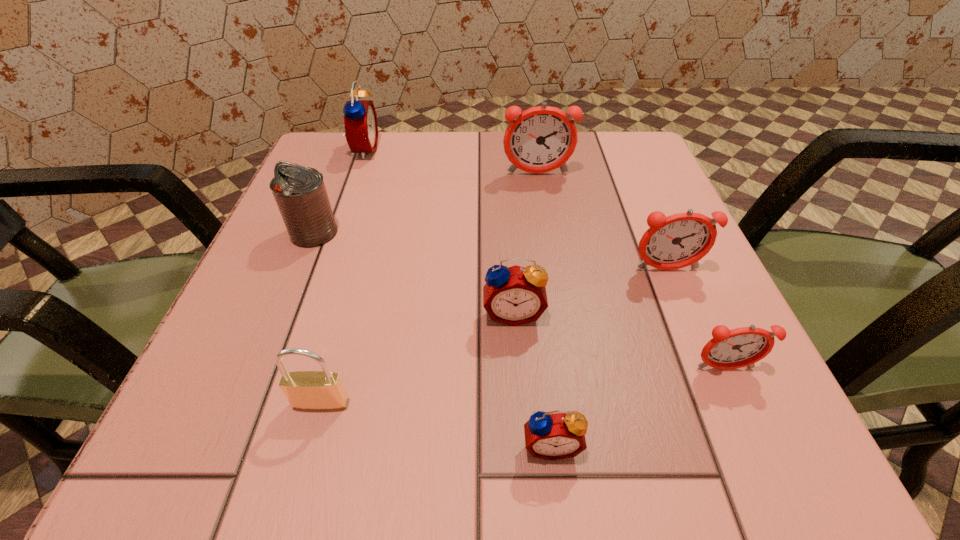
The width and height of the screenshot is (960, 540). In the image, there is a desktop. Identify the location of vacant area at the left edge. (352, 215).

Image resolution: width=960 pixels, height=540 pixels. I want to click on vacant area at the right edge of the desktop, so click(x=646, y=376).

You are a GUI agent. You are given a task and a screenshot of the screen. Output one action in this format:
    pyautogui.click(x=<x>, y=<y>)
    Task: Click on the vacant region at the far left corner of the desktop
    
    Given the screenshot: What is the action you would take?
    pyautogui.click(x=383, y=149)

In the image, there is a desktop. In order to click on free space at the near left corner in this screenshot , I will do [255, 456].

Where is `free region at the far right corner of the desktop`? The width and height of the screenshot is (960, 540). free region at the far right corner of the desktop is located at coordinates (623, 160).

Locate an element on the screen. Image resolution: width=960 pixels, height=540 pixels. vacant space at the near right corner is located at coordinates (681, 471).

The width and height of the screenshot is (960, 540). I want to click on unoccupied area between the nearest alarm clock and the second nearest reddish-pink alarm clock, so click(609, 357).

Image resolution: width=960 pixels, height=540 pixels. Find the location of `vacant area between the padlock and the third nearest alarm clock`. vacant area between the padlock and the third nearest alarm clock is located at coordinates (417, 358).

Locate an element on the screen. This screenshot has width=960, height=540. vacant space that is in between the padlock and the smallest red alarm clock is located at coordinates (436, 424).

Where is `free spot between the second farthest object and the farthest red alarm clock`? This screenshot has width=960, height=540. free spot between the second farthest object and the farthest red alarm clock is located at coordinates (450, 162).